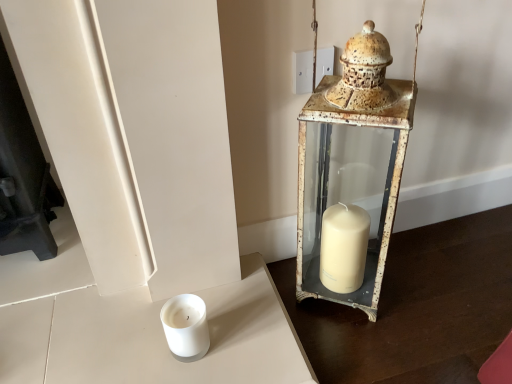
Identify the location of free space in front of rusty metal lantern at right. (369, 347).